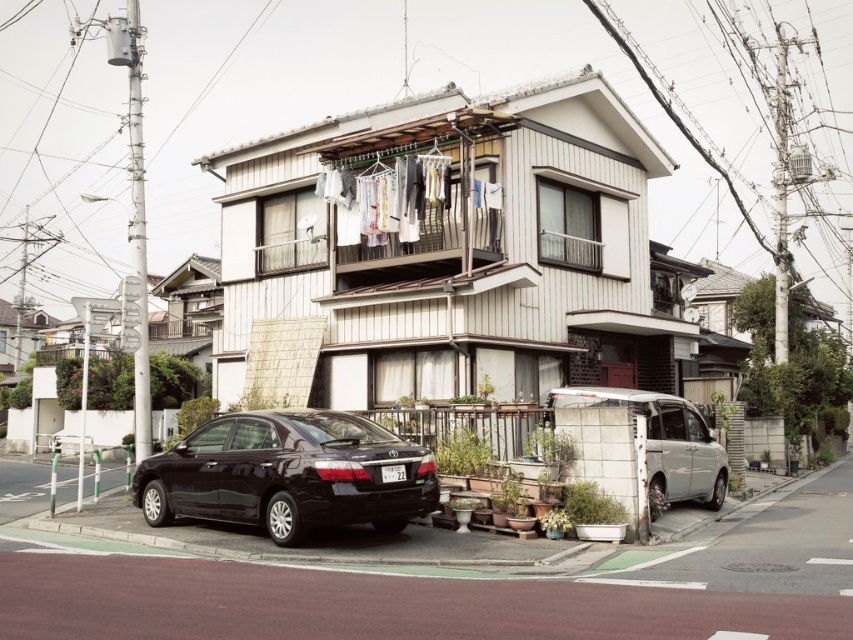
Question: Which point appears farthest from the camera in this image?

Choices:
 (A) (228, 436)
 (B) (607, 397)

Answer: (B)

Question: Considering the real-world distances, which object is farthest from the white fabric clothesline at upper center?

Choices:
 (A) white matte van at lower right
 (B) black matte sedan at lower left

Answer: (B)

Question: Does white fabric clothesline at upper center appear over white matte van at lower right?

Choices:
 (A) yes
 (B) no

Answer: (A)

Question: Can you confirm if white fabric clothesline at upper center is positioned to the right of white matte van at lower right?

Choices:
 (A) no
 (B) yes

Answer: (A)

Question: Can you confirm if black matte sedan at lower left is thinner than white fabric clothesline at upper center?

Choices:
 (A) yes
 (B) no

Answer: (B)

Question: Which point is closer to the camera?

Choices:
 (A) (718, 451)
 (B) (397, 456)
 (C) (421, 225)

Answer: (B)